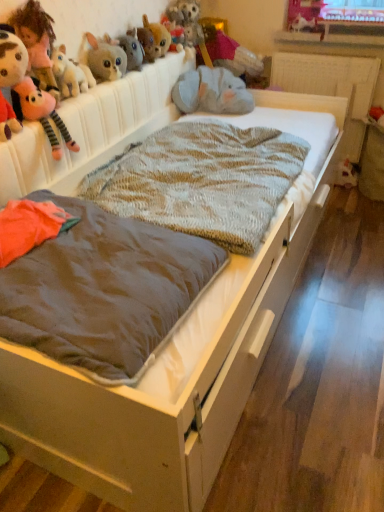
Question: Is fluffy gray plush at upper left, arranged as the 7th toy when viewed from the right, bigger than knitted woolen blanket at center?

Choices:
 (A) yes
 (B) no

Answer: (B)

Question: Does fluffy gray plush at upper left, arranged as the 7th toy when viewed from the right, have a greater width compared to knitted woolen blanket at center?

Choices:
 (A) no
 (B) yes

Answer: (A)

Question: Would you consider fluffy gray plush at upper left, marked as the 4th toy in a left-to-right arrangement, to be distant from knitted woolen blanket at center?

Choices:
 (A) yes
 (B) no

Answer: (B)

Question: Considering the relative sizes of fluffy gray plush at upper left, arranged as the 7th toy when viewed from the right, and knitted woolen blanket at center in the image provided, is fluffy gray plush at upper left, arranged as the 7th toy when viewed from the right, taller than knitted woolen blanket at center?

Choices:
 (A) no
 (B) yes

Answer: (B)

Question: Considering the relative sizes of fluffy gray plush at upper left, marked as the 4th toy in a left-to-right arrangement, and knitted woolen blanket at center in the image provided, is fluffy gray plush at upper left, marked as the 4th toy in a left-to-right arrangement, shorter than knitted woolen blanket at center?

Choices:
 (A) yes
 (B) no

Answer: (B)

Question: Looking at the image, does brown fabric mattress at center seem bigger or smaller compared to fluffy pink plush at upper left, acting as the 2th toy starting from the left?

Choices:
 (A) big
 (B) small

Answer: (A)

Question: Is brown fabric mattress at center in front of or behind fluffy pink plush at upper left, acting as the 2th toy starting from the left, in the image?

Choices:
 (A) behind
 (B) front

Answer: (B)

Question: Visually, is brown fabric mattress at center positioned to the left or to the right of fluffy pink plush at upper left, arranged as the 9th toy when viewed from the right?

Choices:
 (A) right
 (B) left

Answer: (A)

Question: Is brown fabric mattress at center inside the boundaries of fluffy pink plush at upper left, arranged as the 9th toy when viewed from the right, or outside?

Choices:
 (A) inside
 (B) outside

Answer: (B)

Question: From the image's perspective, is fuzzy plush toy at upper center, which is the fifth toy in right-to-left order, above or below brown fabric mattress at center?

Choices:
 (A) above
 (B) below

Answer: (A)

Question: Considering the positions of fuzzy plush toy at upper center, which is the 6th toy in left-to-right order, and brown fabric mattress at center in the image, is fuzzy plush toy at upper center, which is the 6th toy in left-to-right order, bigger or smaller than brown fabric mattress at center?

Choices:
 (A) big
 (B) small

Answer: (B)

Question: Is fuzzy plush toy at upper center, which is the 6th toy in left-to-right order, wider or thinner than brown fabric mattress at center?

Choices:
 (A) wide
 (B) thin

Answer: (B)

Question: From a real-world perspective, is fuzzy plush toy at upper center, which is the fifth toy in right-to-left order, physically located above or below brown fabric mattress at center?

Choices:
 (A) above
 (B) below

Answer: (A)

Question: From the image's perspective, is fluffy gray stuffed animal at upper center, which is the 7th toy in left-to-right order, located above or below fluffy pink plush at upper left, acting as the 2th toy starting from the left?

Choices:
 (A) below
 (B) above

Answer: (B)

Question: Considering the relative positions of fluffy gray stuffed animal at upper center, which is the 7th toy in left-to-right order, and fluffy pink plush at upper left, arranged as the 9th toy when viewed from the right, in the image provided, is fluffy gray stuffed animal at upper center, which is the 7th toy in left-to-right order, to the left or to the right of fluffy pink plush at upper left, arranged as the 9th toy when viewed from the right,?

Choices:
 (A) right
 (B) left

Answer: (A)